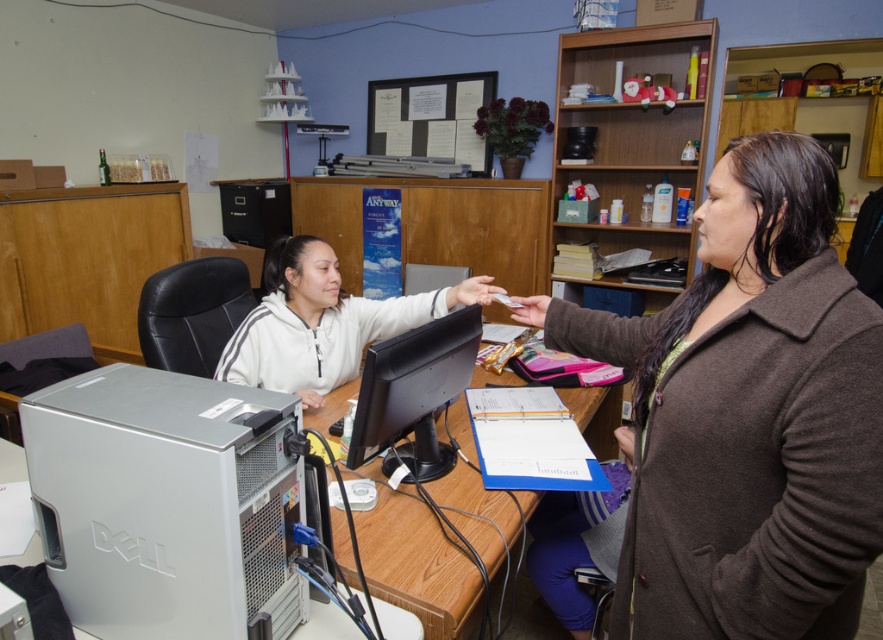
Who is more distant from viewer, (862,330) or (427,436)?

Point (427,436)

Measure the distance between brown woolen coat at center-right and camera.

The distance of brown woolen coat at center-right from camera is 31.41 inches.

Does point (703, 564) come closer to viewer compared to point (457, 339)?

That is True.

Locate an element on the screen. The height and width of the screenshot is (640, 883). brown woolen coat at center-right is located at coordinates (746, 416).

Can you confirm if wooden at center is wider than white fleece jacket at center?

Correct, the width of wooden at center exceeds that of white fleece jacket at center.

Is wooden at center behind white fleece jacket at center?

No, wooden at center is closer to the viewer.

Between point (480, 589) and point (330, 278), which one is positioned in front?

Positioned in front is point (480, 589).

This screenshot has width=883, height=640. In order to click on wooden at center in this screenshot , I will do `click(419, 564)`.

Can you confirm if brown woolen coat at center-right is smaller than white fleece jacket at center?

Yes.

Measure the distance between point (782, 145) and camera.

Point (782, 145) and camera are 38.30 inches apart from each other.

Find the location of a particular element. Image resolution: width=883 pixels, height=640 pixels. brown woolen coat at center-right is located at coordinates (746, 416).